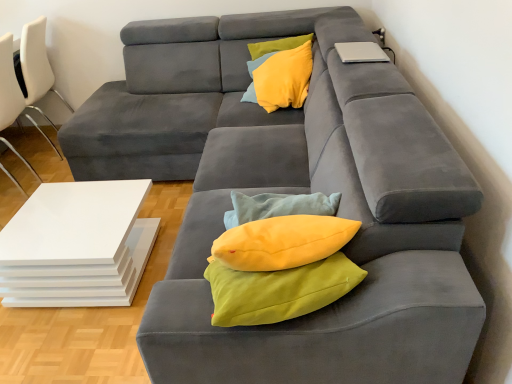
The height and width of the screenshot is (384, 512). What do you see at coordinates (326, 330) in the screenshot? I see `soft gray footrest at lower center` at bounding box center [326, 330].

Describe the element at coordinates (37, 66) in the screenshot. The height and width of the screenshot is (384, 512). I see `white leather chair at left, the first chair from the back` at that location.

Where is `white leather chair at left, the second chair when ordered from front to back`? This screenshot has width=512, height=384. white leather chair at left, the second chair when ordered from front to back is located at coordinates (37, 66).

The width and height of the screenshot is (512, 384). Find the location of `soft gray footrest at lower center`. soft gray footrest at lower center is located at coordinates 326,330.

Consider the image. Between soft gray footrest at lower center and white plastic chair at left, the second chair viewed from the back, which one appears on the right side from the viewer's perspective?

soft gray footrest at lower center is more to the right.

Considering the sizes of objects soft gray footrest at lower center and white plastic chair at left, which is the 1th chair from front to back, in the image provided, who is taller, soft gray footrest at lower center or white plastic chair at left, which is the 1th chair from front to back,?

white plastic chair at left, which is the 1th chair from front to back.

How far apart are soft gray footrest at lower center and white plastic chair at left, the second chair viewed from the back?

They are 2.39 meters apart.

How many degrees apart are the facing directions of soft gray footrest at lower center and white plastic chair at left, which is the 1th chair from front to back?

There is a 90.5-degree angle between the facing directions of soft gray footrest at lower center and white plastic chair at left, which is the 1th chair from front to back.

Considering the relative sizes of white plastic chair at left, which is the 1th chair from front to back, and white glossy table at lower left in the image provided, is white plastic chair at left, which is the 1th chair from front to back, smaller than white glossy table at lower left?

Actually, white plastic chair at left, which is the 1th chair from front to back, might be larger than white glossy table at lower left.

From a real-world perspective, which object stands above the other?

In real-world perspective, white plastic chair at left, which is the 1th chair from front to back, is above.

Is white plastic chair at left, which is the 1th chair from front to back, oriented away from white glossy table at lower left?

No.

Can you see white plastic chair at left, the second chair viewed from the back, touching white glossy table at lower left?

white plastic chair at left, the second chair viewed from the back, is not next to white glossy table at lower left, and they're not touching.

From a real-world perspective, which object rests below the other?

In real-world perspective, white glossy table at lower left is lower.

From the image's perspective, which one is positioned lower, soft gray footrest at lower center or white glossy table at lower left?

soft gray footrest at lower center is shown below in the image.

The width and height of the screenshot is (512, 384). Identify the location of table below the soft gray footrest at lower center (from a real-world perspective). (77, 245).

Is soft gray footrest at lower center aimed at white glossy table at lower left?

No, soft gray footrest at lower center is not oriented towards white glossy table at lower left.

From the picture: In terms of width, does white glossy table at lower left look wider or thinner when compared to white plastic chair at left, which is the 1th chair from front to back?

white glossy table at lower left is wider than white plastic chair at left, which is the 1th chair from front to back.

Based on their sizes in the image, would you say white glossy table at lower left is bigger or smaller than white plastic chair at left, the second chair viewed from the back?

In the image, white glossy table at lower left appears to be smaller than white plastic chair at left, the second chair viewed from the back.

Are white glossy table at lower left and white plastic chair at left, which is the 1th chair from front to back, located far from each other?

Absolutely, white glossy table at lower left is distant from white plastic chair at left, which is the 1th chair from front to back.

Find the location of a particular element. The image size is (512, 384). table beneath the white plastic chair at left, the second chair viewed from the back (from a real-world perspective) is located at coordinates (77, 245).

Is silver metallic laptop at upper right not inside white leather chair at left, the second chair when ordered from front to back?

Absolutely, silver metallic laptop at upper right is external to white leather chair at left, the second chair when ordered from front to back.

From a real-world perspective, is silver metallic laptop at upper right physically located above or below white leather chair at left, the second chair when ordered from front to back?

Clearly, from a real-world perspective, silver metallic laptop at upper right is above white leather chair at left, the second chair when ordered from front to back.

Which is in front, silver metallic laptop at upper right or white leather chair at left, the second chair when ordered from front to back?

Positioned in front is silver metallic laptop at upper right.

Is silver metallic laptop at upper right to the left of white leather chair at left, the first chair from the back, from the viewer's perspective?

No, silver metallic laptop at upper right is not to the left of white leather chair at left, the first chair from the back.

This screenshot has height=384, width=512. Identify the location of throw pillow lying on the right of soft gray footrest at lower center. (284, 78).

Which of these two, yellow fabric pillow at upper center or soft gray footrest at lower center, is smaller?

yellow fabric pillow at upper center.

Relative to soft gray footrest at lower center, is yellow fabric pillow at upper center in front or behind?

Visually, yellow fabric pillow at upper center is located behind soft gray footrest at lower center.

From the image's perspective, which is above, silver metallic laptop at upper right or white plastic chair at left, which is the 1th chair from front to back?

silver metallic laptop at upper right, from the image's perspective.

Is silver metallic laptop at upper right oriented away from white plastic chair at left, the second chair viewed from the back?

No, silver metallic laptop at upper right is not facing away from white plastic chair at left, the second chair viewed from the back.

Is silver metallic laptop at upper right far from white plastic chair at left, the second chair viewed from the back?

That's right, there is a large distance between silver metallic laptop at upper right and white plastic chair at left, the second chair viewed from the back.

In order to click on the 1st chair behind the soft gray footrest at lower center, starting your count from the anchor in this screenshot , I will do `click(9, 85)`.

You are a GUI agent. You are given a task and a screenshot of the screen. Output one action in this format:
    pyautogui.click(x=<x>, y=<y>)
    Task: Click on the table that appears in front of the white plastic chair at left, the second chair viewed from the back
    
    Given the screenshot: What is the action you would take?
    pyautogui.click(x=77, y=245)

Considering their positions, is white plastic chair at left, the second chair viewed from the back, positioned closer to white glossy table at lower left than white leather chair at left, the second chair when ordered from front to back?

white plastic chair at left, the second chair viewed from the back, is positioned closer to the anchor white glossy table at lower left.

Which object lies nearer to the anchor point white leather chair at left, the first chair from the back, white plastic chair at left, the second chair viewed from the back, or yellow fabric pillow at upper center?

white plastic chair at left, the second chair viewed from the back.

Estimate the real-world distances between objects in this image. Which object is further from soft gray footrest at lower center, white leather chair at left, the second chair when ordered from front to back, or yellow fabric pillow at upper center?

Based on the image, white leather chair at left, the second chair when ordered from front to back, appears to be further to soft gray footrest at lower center.

Which object lies nearer to the anchor point soft gray footrest at lower center, white plastic chair at left, which is the 1th chair from front to back, or white leather chair at left, the first chair from the back?

white plastic chair at left, which is the 1th chair from front to back, lies closer to soft gray footrest at lower center than the other object.

Based on their spatial positions, is white glossy table at lower left or white plastic chair at left, the second chair viewed from the back, closer to silver metallic laptop at upper right?

The object closer to silver metallic laptop at upper right is white glossy table at lower left.

Which object lies nearer to the anchor point soft gray footrest at lower center, yellow fabric pillow at upper center or white leather chair at left, the second chair when ordered from front to back?

Among the two, yellow fabric pillow at upper center is located nearer to soft gray footrest at lower center.

Estimate the real-world distances between objects in this image. Which object is further from silver metallic laptop at upper right, yellow fabric pillow at upper center or white plastic chair at left, which is the 1th chair from front to back?

white plastic chair at left, which is the 1th chair from front to back.

From the image, which object appears to be farther from yellow fabric pillow at upper center, white leather chair at left, the first chair from the back, or white glossy table at lower left?

white leather chair at left, the first chair from the back, is further to yellow fabric pillow at upper center.

The width and height of the screenshot is (512, 384). Find the location of `footrest between white leather chair at left, the first chair from the back, and yellow fabric pillow at upper center from left to right`. footrest between white leather chair at left, the first chair from the back, and yellow fabric pillow at upper center from left to right is located at coordinates (326, 330).

At what (x,y) coordinates should I click in order to perform the action: click on table between white plastic chair at left, which is the 1th chair from front to back, and silver metallic laptop at upper right. Please return your answer as a coordinate pair (x, y). The height and width of the screenshot is (384, 512). Looking at the image, I should click on click(77, 245).

The image size is (512, 384). I want to click on footrest between white plastic chair at left, which is the 1th chair from front to back, and yellow fabric pillow at upper center, in the horizontal direction, so click(326, 330).

In order to click on throw pillow situated between white plastic chair at left, which is the 1th chair from front to back, and silver metallic laptop at upper right from left to right in this screenshot , I will do `click(284, 78)`.